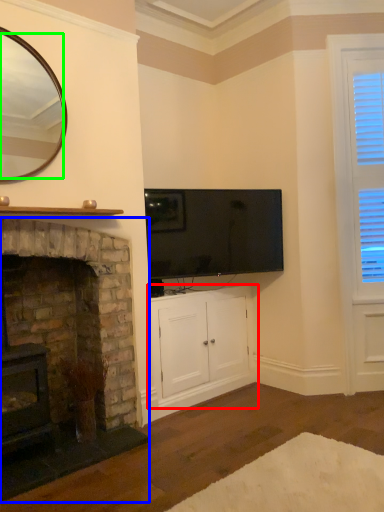
Question: Which object is the farthest from cabinetry (highlighted by a red box)? Choose among these: fireplace (highlighted by a blue box) or mirror (highlighted by a green box).

Choices:
 (A) fireplace
 (B) mirror

Answer: (B)